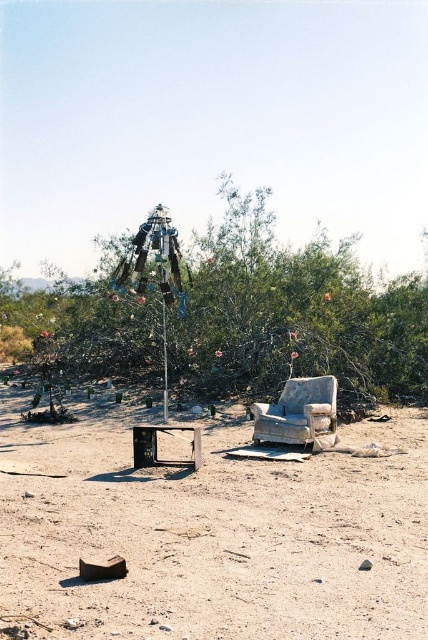
You are a desert explorer who wants to take a photo of the green leafy tree at center and the metallic pole at center. Which object should you focus on first to ensure both are in the frame?

You should focus on the green leafy tree at center first because it is closer to you than the metallic pole at center, so adjusting the camera to include it will also capture the metallic pole at center in the background.

You are standing at the point closest to the old television set. Looking towards the tall structure in the midground, is the point labeled as point (413, 333) located behind or in front of the point labeled point (163, 412) relative to your position?

Point (413, 333) is behind point (163, 412) relative to your position.